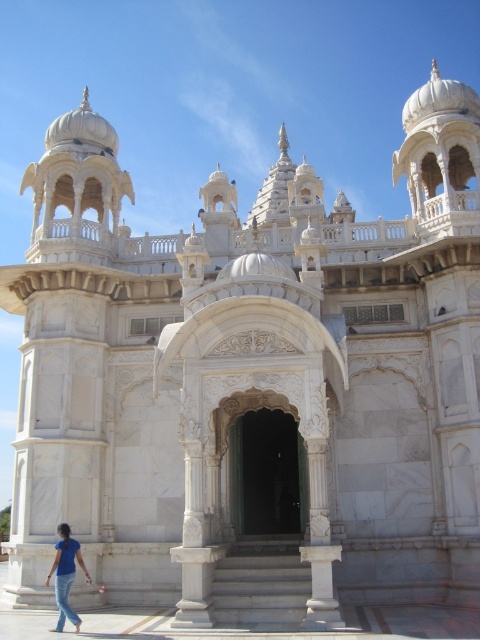
Can you confirm if white marble arch at center is wider than blue denim jeans at lower left?

Correct, the width of white marble arch at center exceeds that of blue denim jeans at lower left.

Locate an element on the screen. The height and width of the screenshot is (640, 480). white marble arch at center is located at coordinates (266, 474).